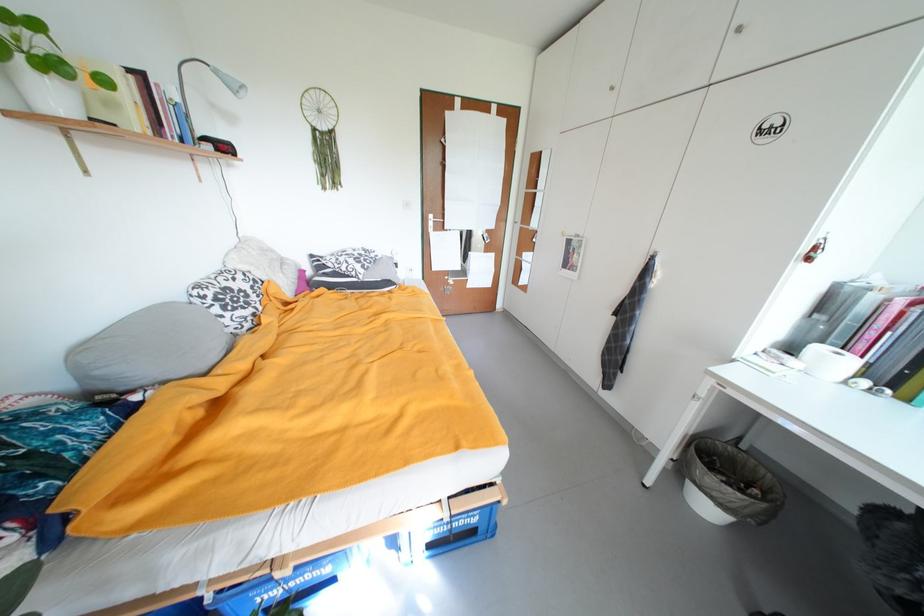
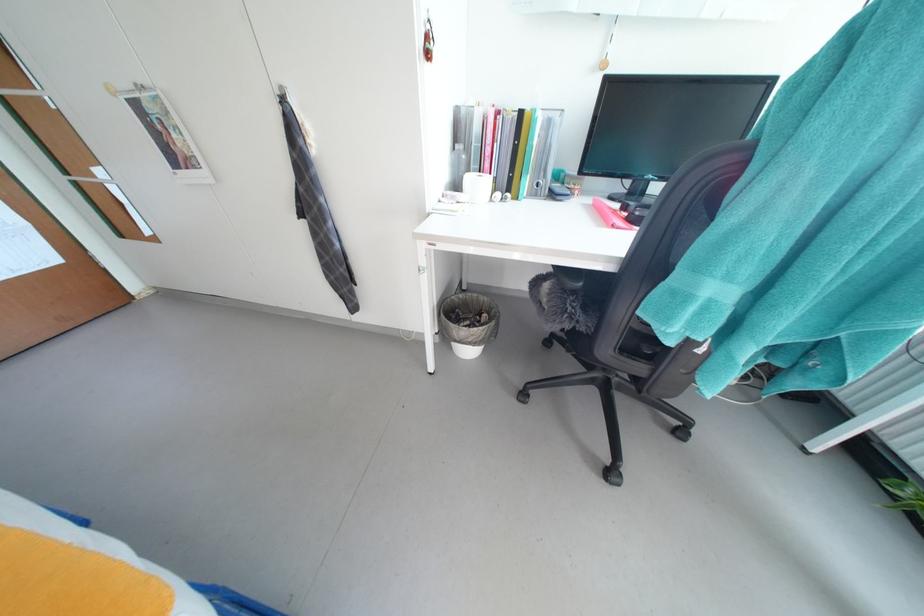
Where in the second image is the point corresponding to [878,368] from the first image?

(503, 182)